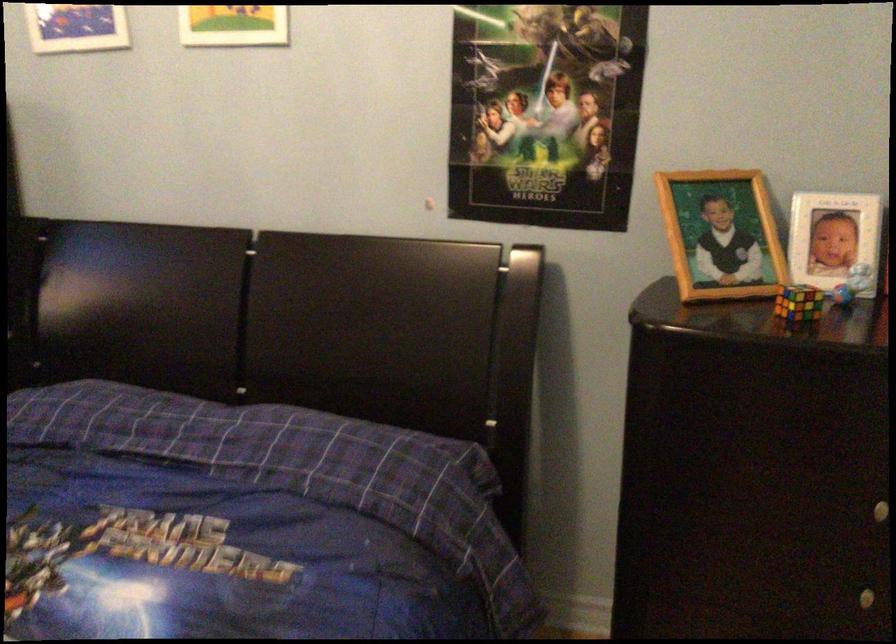
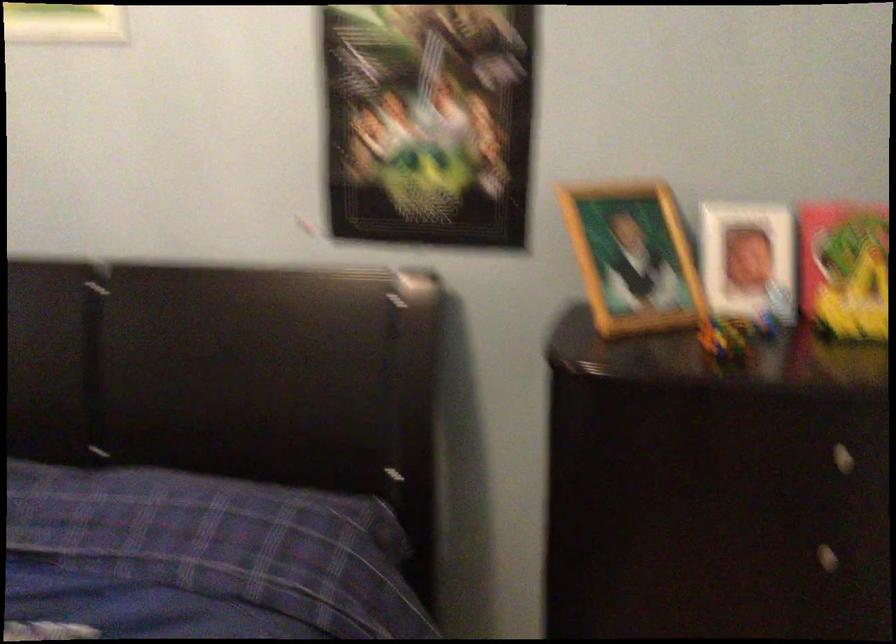
Where in the second image is the point corresponding to point (725, 239) from the first image?

(633, 258)